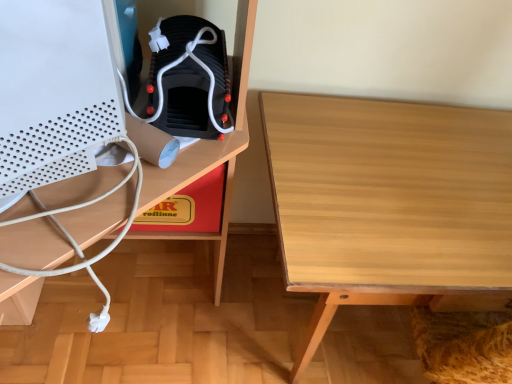
Question: From a real-world perspective, is white matte desktop computer at left over light wood table at center?

Choices:
 (A) no
 (B) yes

Answer: (B)

Question: Does white matte desktop computer at left lie behind light wood table at center?

Choices:
 (A) no
 (B) yes

Answer: (A)

Question: From the image's perspective, does white matte desktop computer at left appear lower than light wood table at center?

Choices:
 (A) yes
 (B) no

Answer: (B)

Question: Is white matte desktop computer at left touching light wood table at center?

Choices:
 (A) yes
 (B) no

Answer: (B)

Question: Is white matte desktop computer at left far from light wood table at center?

Choices:
 (A) yes
 (B) no

Answer: (B)

Question: From a real-world perspective, is white matte desktop computer at left located beneath light wood table at center?

Choices:
 (A) yes
 (B) no

Answer: (B)

Question: Is light wood table at center at the back of black matte boot at center?

Choices:
 (A) yes
 (B) no

Answer: (B)

Question: Does black matte boot at center have a smaller size compared to light wood table at center?

Choices:
 (A) no
 (B) yes

Answer: (B)

Question: From the image's perspective, is black matte boot at center on top of light wood table at center?

Choices:
 (A) no
 (B) yes

Answer: (B)

Question: Does black matte boot at center have a greater width compared to light wood table at center?

Choices:
 (A) yes
 (B) no

Answer: (B)

Question: Is the depth of black matte boot at center less than that of light wood table at center?

Choices:
 (A) no
 (B) yes

Answer: (A)

Question: From a real-world perspective, is black matte boot at center beneath light wood table at center?

Choices:
 (A) yes
 (B) no

Answer: (B)

Question: Could you tell me if light wood table at center is facing red cardboard box at center?

Choices:
 (A) yes
 (B) no

Answer: (B)